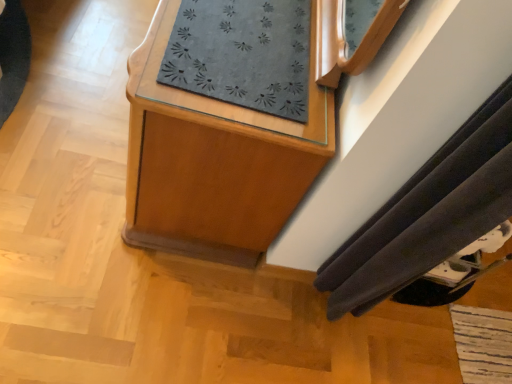
Locate an element on the screen. vacant region to the left of wooden cabinet at center is located at coordinates [72, 81].